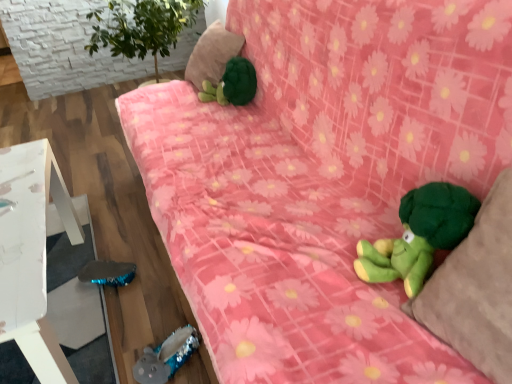
Question: Should I look upward or downward to see green plush pillow at right, which is the first pillow in front-to-back order?

Choices:
 (A) up
 (B) down

Answer: (B)

Question: Is green plush toy at lower right, arranged as the third toy when viewed from the left, next to green plush turtle at upper center, the third toy ordered from the bottom?

Choices:
 (A) yes
 (B) no

Answer: (B)

Question: Considering the relative sizes of green plush toy at lower right, which appears as the first toy when viewed from the front, and green plush turtle at upper center, which appears as the 2th toy when viewed from the right, in the image provided, is green plush toy at lower right, which appears as the first toy when viewed from the front, bigger than green plush turtle at upper center, which appears as the 2th toy when viewed from the right,?

Choices:
 (A) no
 (B) yes

Answer: (A)

Question: Can you confirm if green plush toy at lower right, the 2th toy ordered from the bottom, is shorter than green plush turtle at upper center, the third toy positioned from the front?

Choices:
 (A) no
 (B) yes

Answer: (B)

Question: Is green plush toy at lower right, arranged as the third toy when viewed from the left, far away from green plush turtle at upper center, the third toy positioned from the front?

Choices:
 (A) yes
 (B) no

Answer: (A)

Question: Is green plush toy at lower right, positioned as the third toy in back-to-front order, surrounding green plush turtle at upper center, the third toy positioned from the front?

Choices:
 (A) yes
 (B) no

Answer: (B)

Question: Is green plush toy at lower right, the 2th toy ordered from the bottom, completely or partially outside of green plush turtle at upper center, which appears as the 2th toy when viewed from the right?

Choices:
 (A) yes
 (B) no

Answer: (A)

Question: Is green plush turtle at upper center, the third toy positioned from the front, shorter than green plush toy at lower right, arranged as the third toy when viewed from the left?

Choices:
 (A) no
 (B) yes

Answer: (A)

Question: Is green plush turtle at upper center, the 1th toy when ordered from back to front, smaller than green plush toy at lower right, positioned as the first toy in right-to-left order?

Choices:
 (A) yes
 (B) no

Answer: (B)

Question: Is the depth of green plush turtle at upper center, which appears as the 2th toy when viewed from the right, greater than that of green plush toy at lower right, positioned as the first toy in right-to-left order?

Choices:
 (A) yes
 (B) no

Answer: (A)

Question: Is green plush turtle at upper center, positioned as the 2th toy in left-to-right order, placed right next to green plush toy at lower right, the 2th toy ordered from the bottom?

Choices:
 (A) no
 (B) yes

Answer: (A)

Question: From a real-world perspective, is green plush turtle at upper center, the third toy ordered from the bottom, located beneath green plush toy at lower right, positioned as the first toy in right-to-left order?

Choices:
 (A) no
 (B) yes

Answer: (B)

Question: Is green plush toy at lower right, positioned as the first toy in right-to-left order, located within green plush turtle at upper center, the third toy ordered from the bottom?

Choices:
 (A) no
 (B) yes

Answer: (A)

Question: Can you confirm if shiny blue plush toy at lower left, which is the third toy in right-to-left order, is shorter than green plush turtle at upper center, which appears as the 2th toy when viewed from the right?

Choices:
 (A) no
 (B) yes

Answer: (B)